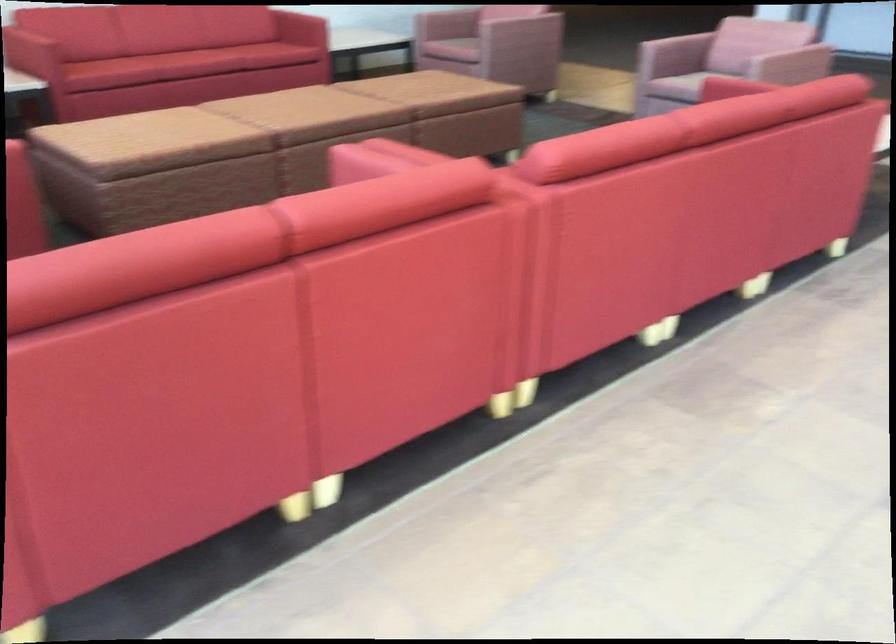
This screenshot has width=896, height=644. What do you see at coordinates (400, 154) in the screenshot? I see `the sofa armrest` at bounding box center [400, 154].